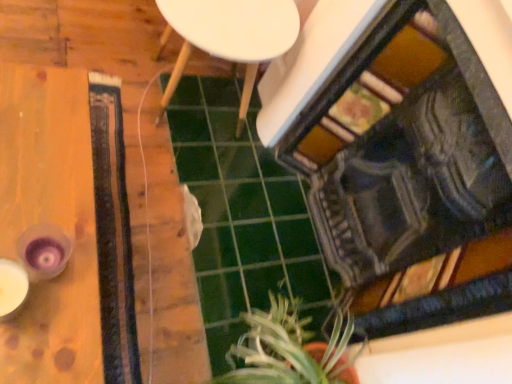
Question: In terms of width, does white matte side table at center look wider or thinner when compared to wooden table at left?

Choices:
 (A) thin
 (B) wide

Answer: (B)

Question: Is white matte side table at center spatially inside wooden table at left, or outside of it?

Choices:
 (A) inside
 (B) outside

Answer: (B)

Question: Which of these objects is positioned closest to the wooden table at left?

Choices:
 (A) white matte side table at center
 (B) green leafy plant at lower center

Answer: (A)

Question: Considering the real-world distances, which object is closest to the green leafy plant at lower center?

Choices:
 (A) white matte side table at center
 (B) wooden table at left

Answer: (B)